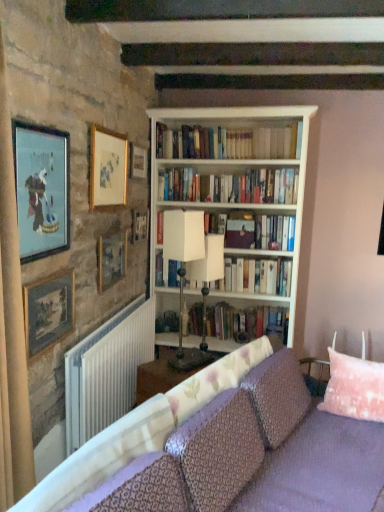
Question: Looking at the image, does matte gold picture frame at upper left, which is the 1th picture frame from front to back, seem bigger or smaller compared to wooden picture frame at upper left, which is the fifth picture frame from back to front?

Choices:
 (A) big
 (B) small

Answer: (A)

Question: Is matte gold picture frame at upper left, the sixth picture frame when ordered from back to front, wider or thinner than wooden picture frame at upper left, marked as the second picture frame in a front-to-back arrangement?

Choices:
 (A) wide
 (B) thin

Answer: (A)

Question: Estimate the real-world distances between objects in this image. Which object is closer to the white paperbacks at center, the 3th book positioned from the bottom?

Choices:
 (A) gold-framed picture at upper left, which ranks as the third picture frame in front-to-back order
 (B) white paperbacks at upper center, the fourth book when ordered from bottom to top
 (C) white matte table lamp at center, which ranks as the second table lamp in right-to-left order
 (D) white plastic radiator at lower left
 (E) white wooden bookcase at center

Answer: (E)

Question: Which object is the closest to the pink fabric pillow at right?

Choices:
 (A) white paperbacks at upper center, the fourth book when ordered from bottom to top
 (B) white paper book at center, the second book when ordered from bottom to top
 (C) white plastic radiator at lower left
 (D) white matte table lamp at center, which ranks as the second table lamp in right-to-left order
 (E) hardcover books at center, placed as the first book when sorted from bottom to top

Answer: (B)